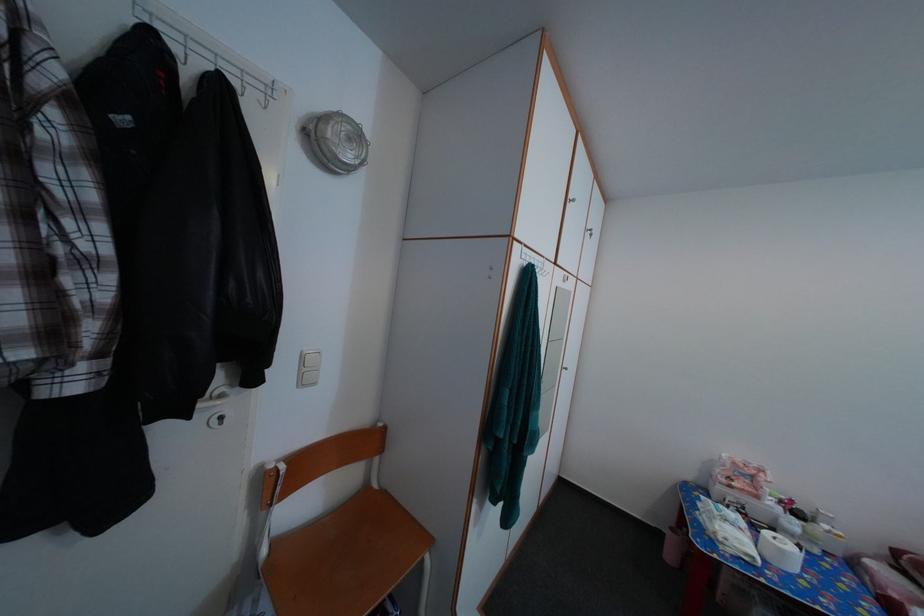
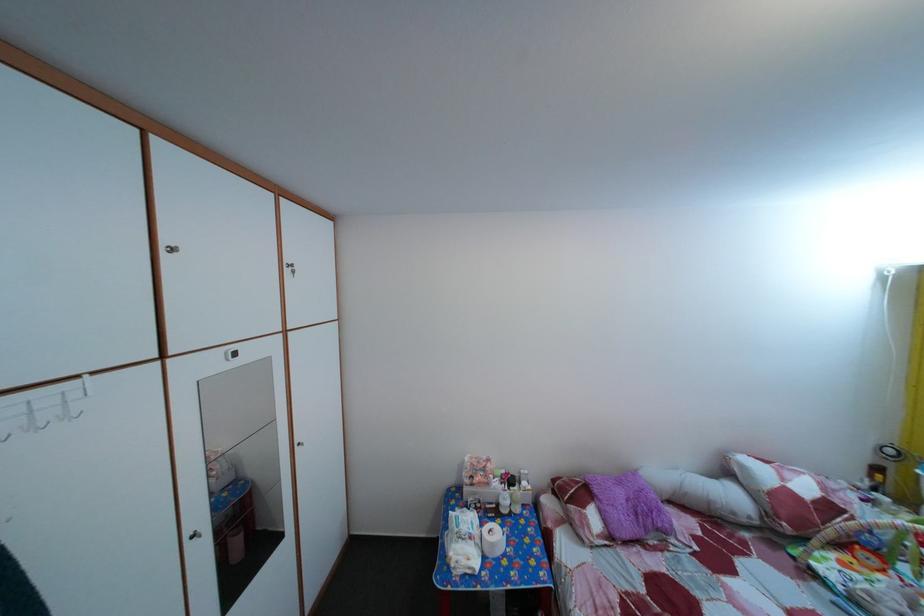
Find the pixel in the second image that matches the point at 601,244 in the first image.

(304, 280)